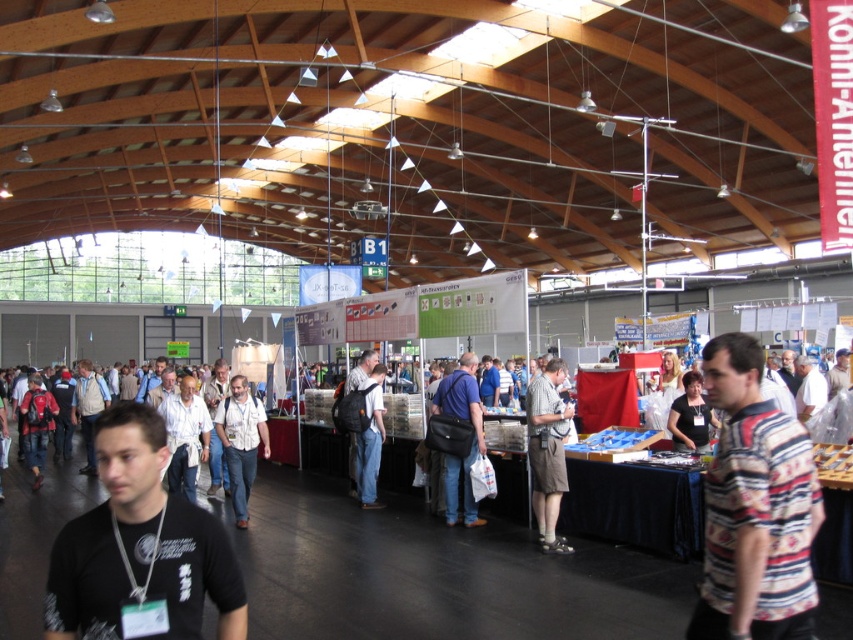
Question: Does gray cotton shirt at center have a greater width compared to dark blue shirt at center?

Choices:
 (A) yes
 (B) no

Answer: (B)

Question: Does striped cotton shirt at center have a greater width compared to dark blue shirt at center?

Choices:
 (A) yes
 (B) no

Answer: (A)

Question: Which of the following is the farthest from the observer?

Choices:
 (A) (692, 371)
 (B) (532, 488)

Answer: (A)

Question: Estimate the real-world distances between objects in this image. Which object is farther from the matte blue shirt at center?

Choices:
 (A) white shirt at center
 (B) striped cotton shirt at center
 (C) black matte t-shirt at lower left

Answer: (C)

Question: From the image, what is the correct spatial relationship of matte blue shirt at center in relation to dark blue jeans at center?

Choices:
 (A) above
 (B) below

Answer: (A)

Question: Which point is closer to the camera?

Choices:
 (A) striped cotton shirt at center
 (B) dark blue jeans at center
 (C) black matte t-shirt at lower left
 (D) matte blue shirt at center

Answer: (C)